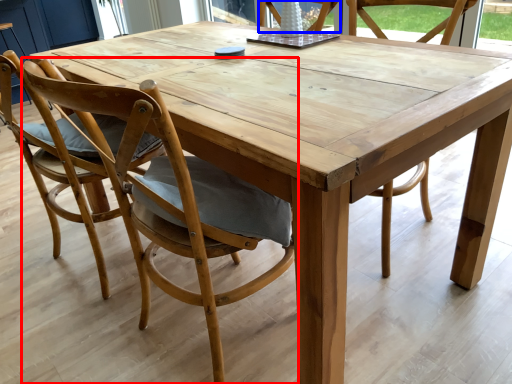
Question: Among these objects, which one is nearest to the camera, chair (highlighted by a red box) or chair (highlighted by a blue box)?

Choices:
 (A) chair
 (B) chair

Answer: (A)